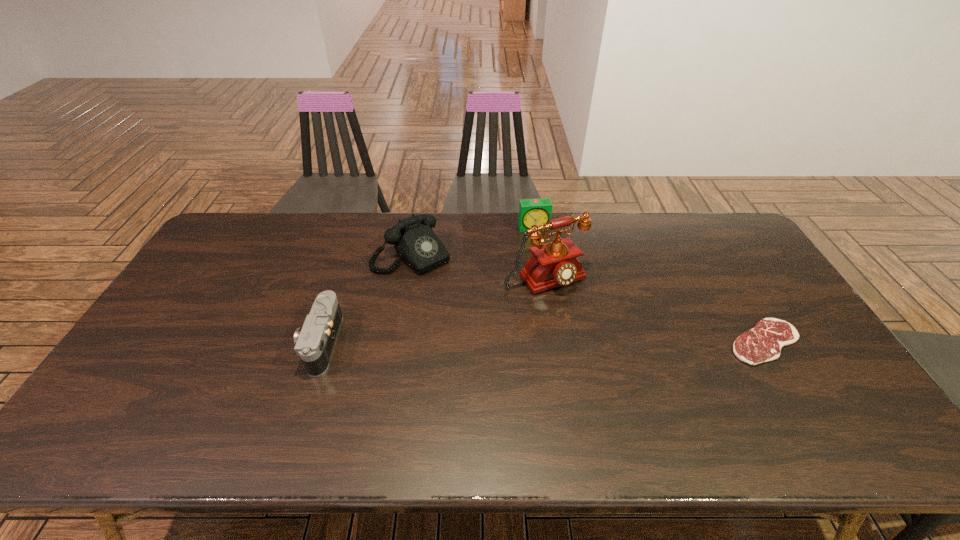
In order to click on vacant region located on the lens of the camera in this screenshot , I will do `click(198, 343)`.

Locate an element on the screen. The width and height of the screenshot is (960, 540). vacant space located on the back of the rightmost object is located at coordinates (726, 278).

Where is `free spot located on the dial of the left telephone`? The width and height of the screenshot is (960, 540). free spot located on the dial of the left telephone is located at coordinates (479, 318).

This screenshot has height=540, width=960. What are the coordinates of `free location located on the dial of the left telephone` in the screenshot? It's located at (466, 304).

I want to click on free spot located on the dial of the left telephone, so click(x=486, y=325).

Image resolution: width=960 pixels, height=540 pixels. What are the coordinates of `vacant space located on the front-facing side of the alarm clock` in the screenshot? It's located at (544, 259).

Find the location of a particular element. Image resolution: width=960 pixels, height=540 pixels. free space located on the front-facing side of the alarm clock is located at coordinates (539, 241).

The height and width of the screenshot is (540, 960). Identify the location of vacant space located 0.360m on the front-facing side of the alarm clock. (559, 305).

At what (x,y) coordinates should I click in order to perform the action: click on vacant region located 0.390m on the dial of the tallest object. Please return your answer as a coordinate pair (x, y). The height and width of the screenshot is (540, 960). Looking at the image, I should click on (644, 400).

Locate an element on the screen. Image resolution: width=960 pixels, height=540 pixels. vacant space located 0.380m on the dial of the tallest object is located at coordinates (641, 396).